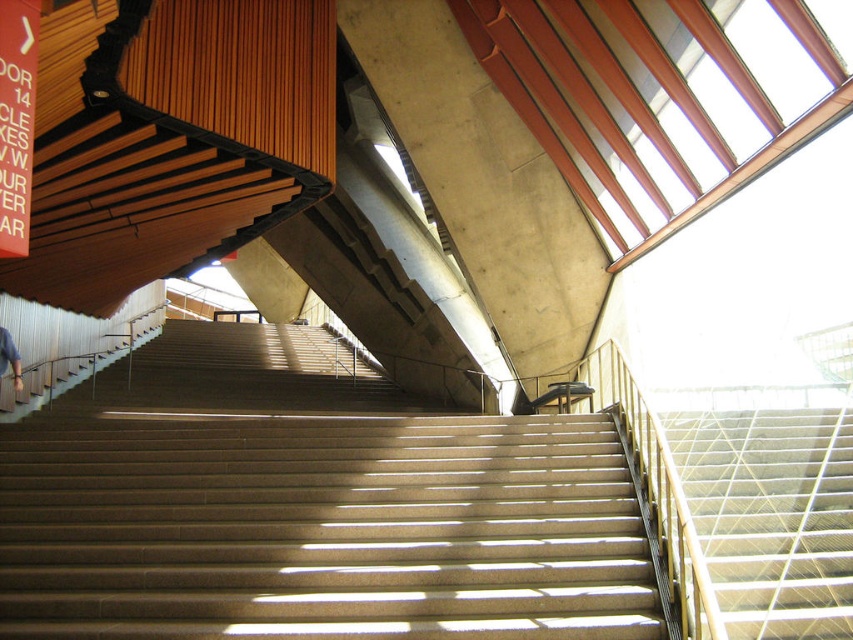
You are standing at the bottom of the brown concrete stairs at center and want to move towards the blue denim jeans at lower left. Which direction should you go?

You should move to the left because the brown concrete stairs at center are to the right of the blue denim jeans at lower left, so moving left will take you towards them.

You are a delivery person carrying a large package that is 1.5 meters in length. You need to navigate through the brown concrete stairs at center and the blue denim jeans at lower left. Which object will require more space due to its size?

The brown concrete stairs at center has a larger size compared to blue denim jeans at lower left, so it will require more space.

You are a delivery person carrying a package that is 3 meters long. You need to move it through the space between the brown concrete stairs at center and the metallic silver stairs at center. Can you fit the package through that space?

The space between the brown concrete stairs at center and the metallic silver stairs at center is 2.86 meters. Since the package is 3 meters long, it is longer than the available space, so the package cannot fit through that space.